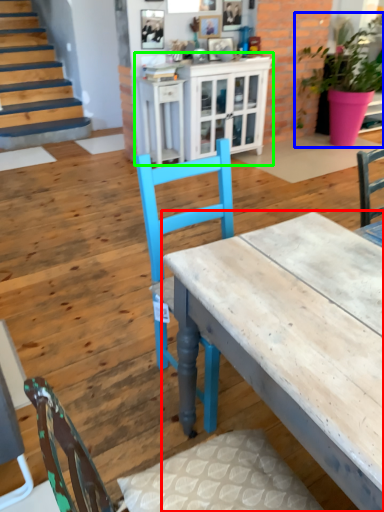
Question: Considering the real-world distances, which object is closest to desk (highlighted by a red box)? houseplant (highlighted by a blue box) or cabinetry (highlighted by a green box).

Choices:
 (A) houseplant
 (B) cabinetry

Answer: (B)